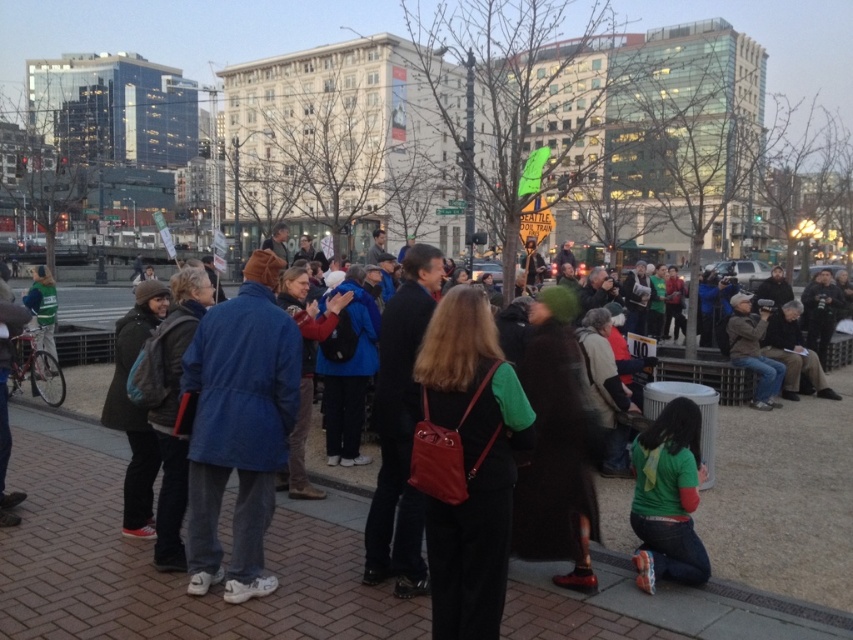
You are a photographer trying to capture a photo of the protest scene. You want to ensure both the blue fabric coat at center and the green matte shirt at lower right are visible in your shot. Based on their positions, which object should you focus on first to frame the shot properly?

The blue fabric coat at center is above the green matte shirt at lower right, so you should focus on the blue fabric coat at center first to ensure both are in frame.

You are a delivery person who needs to locate a matte red backpack at center in a crowded urban protest scene. According to the coordinates provided, where should you look to find it?

The matte red backpack at center is located at point [467,461].

Consider the image. You are organizing a charity event and need to transport items from the venue to a nearby storage unit. You have a matte red backpack at center and a green matte shirt at lower right. Which item can carry more items due to its size?

The matte red backpack at center has a larger size compared to the green matte shirt at lower right, so it can carry more items.